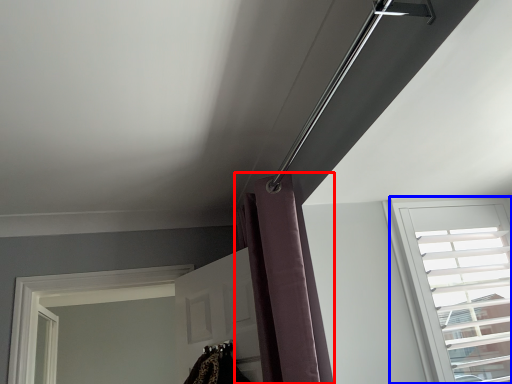
Question: Which of the following is the closest to the observer, shower curtain (highlighted by a red box) or window (highlighted by a blue box)?

Choices:
 (A) shower curtain
 (B) window

Answer: (A)